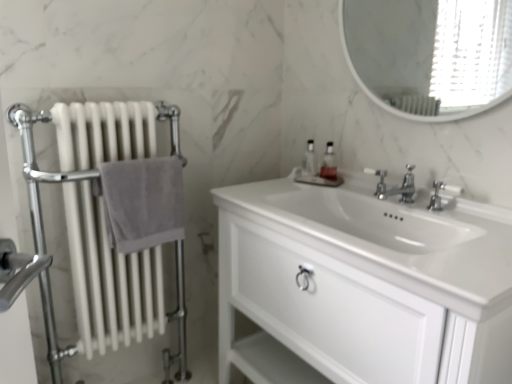
This screenshot has height=384, width=512. I want to click on vacant area on the back side of chrome metallic faucet at center, arranged as the second tap when viewed from the right, so click(370, 197).